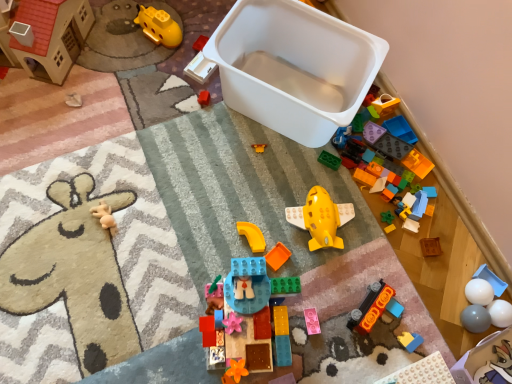
Find the location of a particular element. This screenshot has height=384, width=512. vacant space in between yellow plastic submarine at upper left, which ranks as the fourteenth toy in right-to-left order, and translucent blue plastic building block at center, the fifth toy viewed from the left is located at coordinates (197, 165).